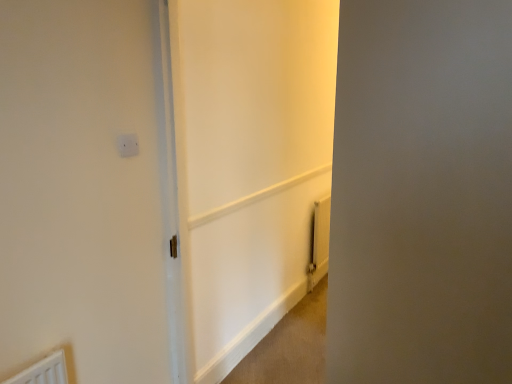
In the scene shown: Measure the distance between yellow metallic radiator at lower right and camera.

yellow metallic radiator at lower right is 3.35 meters away from camera.

Measure the distance between point (120, 143) and camera.

The distance of point (120, 143) from camera is 1.62 meters.

You are a GUI agent. You are given a task and a screenshot of the screen. Output one action in this format:
    pyautogui.click(x=<x>, y=<y>)
    Task: Click on the white glossy door at center, which is the 1th screen door in left-to-right order
    
    Given the screenshot: What is the action you would take?
    pyautogui.click(x=247, y=166)

This screenshot has width=512, height=384. What do you see at coordinates (247, 166) in the screenshot? I see `white glossy door at center, which is the 1th screen door in left-to-right order` at bounding box center [247, 166].

The image size is (512, 384). Identify the location of white matte screen door at right, the 1th screen door positioned from the right. (422, 193).

Who is shorter, yellow metallic radiator at lower right or white matte screen door at right, the 1th screen door positioned from the right?

With less height is yellow metallic radiator at lower right.

Which of these two, yellow metallic radiator at lower right or white matte screen door at right, the 2th screen door from the left, is bigger?

white matte screen door at right, the 2th screen door from the left.

Is yellow metallic radiator at lower right not within white matte screen door at right, the 1th screen door positioned from the right?

Yes, yellow metallic radiator at lower right is outside of white matte screen door at right, the 1th screen door positioned from the right.

Does yellow metallic radiator at lower right appear on the left side of white matte screen door at right, the 1th screen door positioned from the right?

Incorrect, yellow metallic radiator at lower right is not on the left side of white matte screen door at right, the 1th screen door positioned from the right.

From the image's perspective, relative to white matte screen door at right, the 2th screen door from the left, is white glossy door at center, placed as the 2th screen door when sorted from right to left, above or below?

white glossy door at center, placed as the 2th screen door when sorted from right to left, is situated higher than white matte screen door at right, the 2th screen door from the left, in the image.

Does white glossy door at center, placed as the 2th screen door when sorted from right to left, have a greater height compared to white matte screen door at right, the 2th screen door from the left?

Indeed, white glossy door at center, placed as the 2th screen door when sorted from right to left, has a greater height compared to white matte screen door at right, the 2th screen door from the left.

Is white glossy door at center, which is the 1th screen door in left-to-right order, not within white matte screen door at right, the 1th screen door positioned from the right?

Indeed, white glossy door at center, which is the 1th screen door in left-to-right order, is completely outside white matte screen door at right, the 1th screen door positioned from the right.

From a real-world perspective, is white plastic electric outlet at upper center above or below white glossy door at center, which is the 1th screen door in left-to-right order?

In terms of real-world spatial position, white plastic electric outlet at upper center is above white glossy door at center, which is the 1th screen door in left-to-right order.

Based on the photo, are white plastic electric outlet at upper center and white glossy door at center, placed as the 2th screen door when sorted from right to left, located far from each other?

Yes, white plastic electric outlet at upper center and white glossy door at center, placed as the 2th screen door when sorted from right to left, are located far from each other.

Looking at their sizes, would you say white plastic electric outlet at upper center is wider or thinner than white glossy door at center, which is the 1th screen door in left-to-right order?

white plastic electric outlet at upper center is thinner than white glossy door at center, which is the 1th screen door in left-to-right order.

Between white plastic electric outlet at upper center and white glossy door at center, placed as the 2th screen door when sorted from right to left, which one is positioned behind?

Positioned behind is white plastic electric outlet at upper center.

Is white matte screen door at right, the 2th screen door from the left, to the left or to the right of yellow metallic radiator at lower right in the image?

white matte screen door at right, the 2th screen door from the left, is positioned on yellow metallic radiator at lower right's left side.

Considering the positions of point (466, 13) and point (316, 213), is point (466, 13) closer or farther from the camera than point (316, 213)?

Point (466, 13).

Does white matte screen door at right, the 1th screen door positioned from the right, have a lesser height compared to yellow metallic radiator at lower right?

No, white matte screen door at right, the 1th screen door positioned from the right, is not shorter than yellow metallic radiator at lower right.

In the scene shown: Is white matte screen door at right, the 1th screen door positioned from the right, outside of yellow metallic radiator at lower right?

Yes, white matte screen door at right, the 1th screen door positioned from the right, is located beyond the bounds of yellow metallic radiator at lower right.

Does white glossy door at center, which is the 1th screen door in left-to-right order, appear on the right side of white plastic electric outlet at upper center?

Correct, you'll find white glossy door at center, which is the 1th screen door in left-to-right order, to the right of white plastic electric outlet at upper center.

From a real-world perspective, who is located lower, white glossy door at center, placed as the 2th screen door when sorted from right to left, or white plastic electric outlet at upper center?

From a 3D spatial view, white glossy door at center, placed as the 2th screen door when sorted from right to left, is below.

Are white glossy door at center, placed as the 2th screen door when sorted from right to left, and white plastic electric outlet at upper center far apart?

That's right, there is a large distance between white glossy door at center, placed as the 2th screen door when sorted from right to left, and white plastic electric outlet at upper center.

In order to click on electric outlet to the left of white glossy door at center, placed as the 2th screen door when sorted from right to left in this screenshot , I will do tap(128, 145).

Is the depth of white matte screen door at right, the 2th screen door from the left, greater than that of white plastic electric outlet at upper center?

No, it is not.

Which is more to the left, white matte screen door at right, the 2th screen door from the left, or white plastic electric outlet at upper center?

white plastic electric outlet at upper center is more to the left.

Can you confirm if white matte screen door at right, the 2th screen door from the left, is smaller than white plastic electric outlet at upper center?

Actually, white matte screen door at right, the 2th screen door from the left, might be larger than white plastic electric outlet at upper center.

Locate an element on the screen. Image resolution: width=512 pixels, height=384 pixels. the 2nd screen door to the right when counting from the white plastic electric outlet at upper center is located at coordinates (422, 193).

Is yellow metallic radiator at lower right wider than white glossy door at center, which is the 1th screen door in left-to-right order?

In fact, yellow metallic radiator at lower right might be narrower than white glossy door at center, which is the 1th screen door in left-to-right order.

Considering the positions of point (315, 224) and point (258, 72), is point (315, 224) closer or farther from the camera than point (258, 72)?

Point (315, 224) appears to be farther away from the viewer than point (258, 72).

Is yellow metallic radiator at lower right turned away from white glossy door at center, which is the 1th screen door in left-to-right order?

yellow metallic radiator at lower right is not turned away from white glossy door at center, which is the 1th screen door in left-to-right order.

From a real-world perspective, who is located lower, yellow metallic radiator at lower right or white glossy door at center, which is the 1th screen door in left-to-right order?

yellow metallic radiator at lower right is physically lower.

From a real-world perspective, count 2nd screen doors upward from the yellow metallic radiator at lower right and point to it. Please provide its 2D coordinates.

[(422, 193)]

Image resolution: width=512 pixels, height=384 pixels. Identify the location of screen door that is in front of the white glossy door at center, placed as the 2th screen door when sorted from right to left. (422, 193).

From the image, which object appears to be nearer to white matte screen door at right, the 1th screen door positioned from the right, white glossy door at center, placed as the 2th screen door when sorted from right to left, or yellow metallic radiator at lower right?

white glossy door at center, placed as the 2th screen door when sorted from right to left.

In the scene shown: From the image, which object appears to be nearer to white glossy door at center, which is the 1th screen door in left-to-right order, white matte screen door at right, the 1th screen door positioned from the right, or white plastic electric outlet at upper center?

Among the two, white plastic electric outlet at upper center is located nearer to white glossy door at center, which is the 1th screen door in left-to-right order.

When comparing their distances from white plastic electric outlet at upper center, does yellow metallic radiator at lower right or white matte screen door at right, the 1th screen door positioned from the right, seem closer?

white matte screen door at right, the 1th screen door positioned from the right, is positioned closer to the anchor white plastic electric outlet at upper center.

Looking at this image, estimate the real-world distances between objects in this image. Which object is closer to white plastic electric outlet at upper center, white glossy door at center, which is the 1th screen door in left-to-right order, or white matte screen door at right, the 2th screen door from the left?

Based on the image, white matte screen door at right, the 2th screen door from the left, appears to be nearer to white plastic electric outlet at upper center.

Estimate the real-world distances between objects in this image. Which object is closer to white matte screen door at right, the 1th screen door positioned from the right, yellow metallic radiator at lower right or white glossy door at center, which is the 1th screen door in left-to-right order?

The object closer to white matte screen door at right, the 1th screen door positioned from the right, is white glossy door at center, which is the 1th screen door in left-to-right order.

Considering their positions, is white plastic electric outlet at upper center positioned closer to white glossy door at center, placed as the 2th screen door when sorted from right to left, than white matte screen door at right, the 2th screen door from the left?

white plastic electric outlet at upper center lies closer to white glossy door at center, placed as the 2th screen door when sorted from right to left, than the other object.

Based on their spatial positions, is white plastic electric outlet at upper center or yellow metallic radiator at lower right closer to white glossy door at center, placed as the 2th screen door when sorted from right to left?

Among the two, yellow metallic radiator at lower right is located nearer to white glossy door at center, placed as the 2th screen door when sorted from right to left.

Estimate the real-world distances between objects in this image. Which object is further from white glossy door at center, which is the 1th screen door in left-to-right order, white matte screen door at right, the 1th screen door positioned from the right, or yellow metallic radiator at lower right?

Among the two, white matte screen door at right, the 1th screen door positioned from the right, is located further to white glossy door at center, which is the 1th screen door in left-to-right order.

Find the location of a particular element. Image resolution: width=512 pixels, height=384 pixels. screen door between white matte screen door at right, the 1th screen door positioned from the right, and white plastic electric outlet at upper center, along the z-axis is located at coordinates (247, 166).

The height and width of the screenshot is (384, 512). In order to click on screen door between white matte screen door at right, the 1th screen door positioned from the right, and yellow metallic radiator at lower right in the front-back direction in this screenshot , I will do `click(247, 166)`.

This screenshot has height=384, width=512. What are the coordinates of `electric outlet between white glossy door at center, which is the 1th screen door in left-to-right order, and yellow metallic radiator at lower right from front to back` in the screenshot? It's located at (128, 145).

Identify the location of electric outlet between white matte screen door at right, the 1th screen door positioned from the right, and yellow metallic radiator at lower right in the front-back direction. (128, 145).